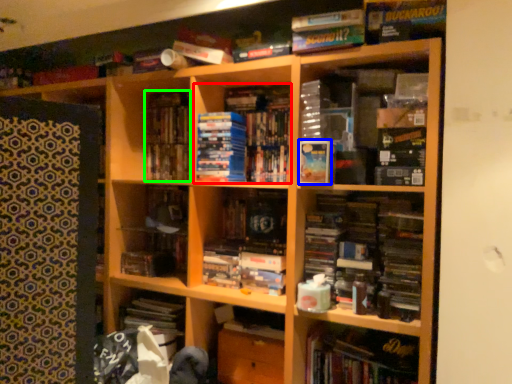
Question: Estimate the real-world distances between objects in this image. Which object is closer to book (highlighted by a red box), paperback book (highlighted by a blue box) or book (highlighted by a green box)?

Choices:
 (A) paperback book
 (B) book

Answer: (A)